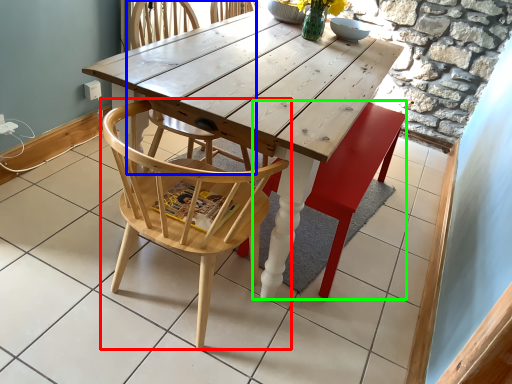
Question: Which object is the farthest from chair (highlighted by a red box)? Choose among these: chair (highlighted by a blue box) or swivel chair (highlighted by a green box).

Choices:
 (A) chair
 (B) swivel chair

Answer: (A)